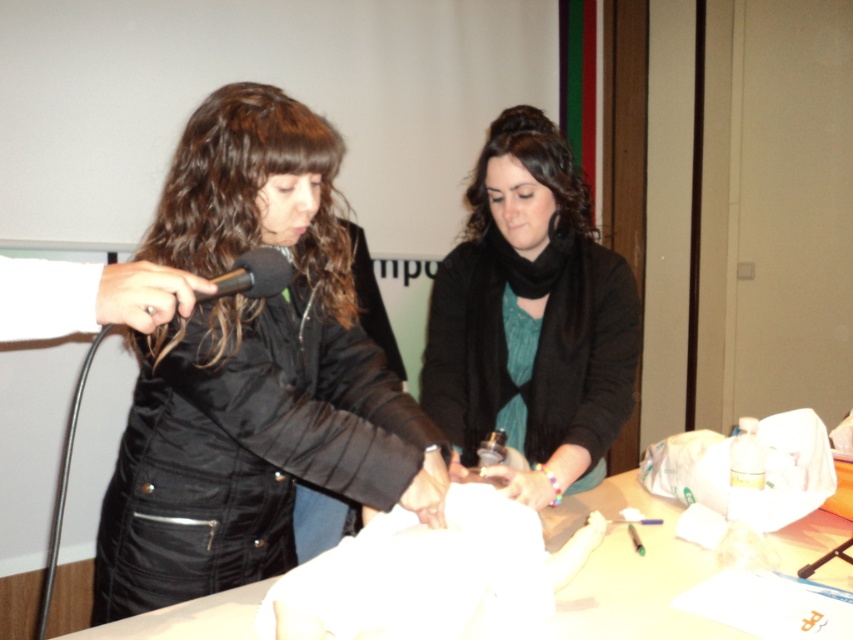
You are organizing a small event and need to place a decorative item between the black matte jacket at center and the white paper at center. Given their sizes, which object should you place closer to the smaller one to balance the arrangement?

The white paper at center is smaller than the black matte jacket at center. To balance the arrangement, place the decorative item closer to the white paper at center so that it visually compensates for the size difference.